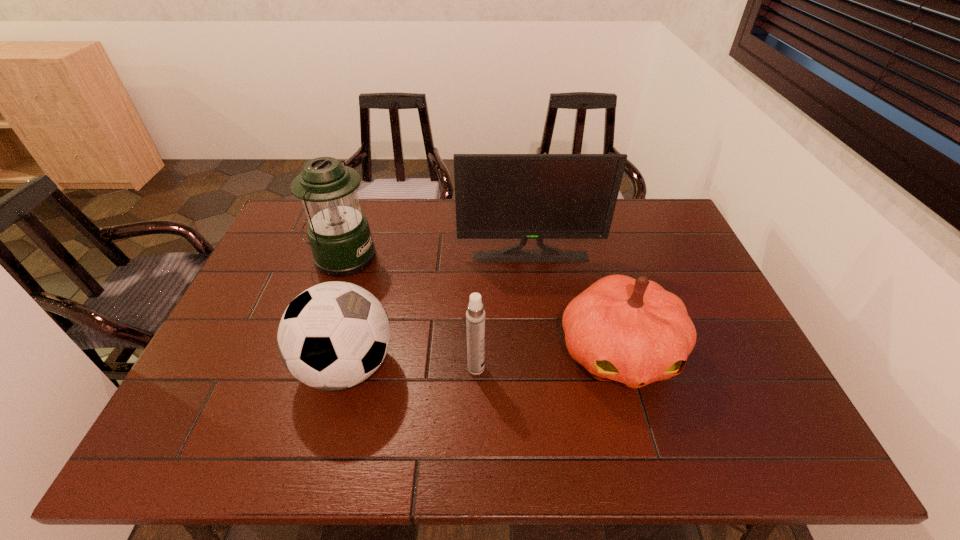
Find the location of a particular element. This screenshot has height=540, width=960. free region that satisfies the following two spatial constraints: 1. on the main logo of the soccer ball; 2. on the left side of the aerosol can is located at coordinates (347, 368).

You are a GUI agent. You are given a task and a screenshot of the screen. Output one action in this format:
    pyautogui.click(x=<x>, y=<y>)
    Task: Click on the free space that satisfies the following two spatial constraints: 1. on the main logo of the aerosol can; 2. on the right side of the soccer ball
    This screenshot has width=960, height=540.
    Given the screenshot: What is the action you would take?
    pyautogui.click(x=347, y=368)